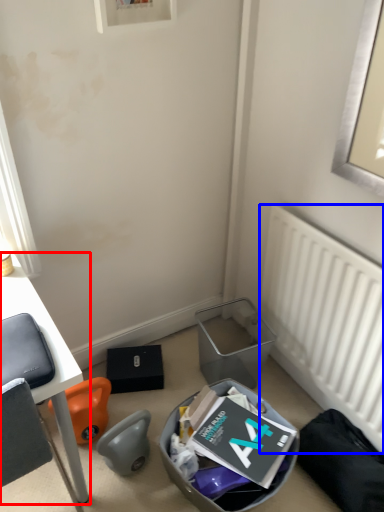
Question: Which object is closer to the camera taking this photo, desk (highlighted by a red box) or radiator (highlighted by a blue box)?

Choices:
 (A) desk
 (B) radiator

Answer: (A)